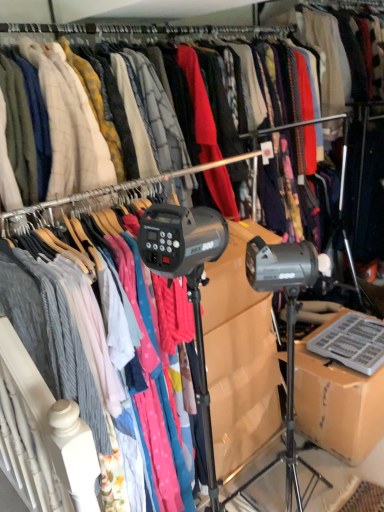
Question: Is brown cardboard box at lower right to the right of matte gray sweater at center from the viewer's perspective?

Choices:
 (A) no
 (B) yes

Answer: (B)

Question: Does brown cardboard box at lower right contain matte gray sweater at center?

Choices:
 (A) no
 (B) yes

Answer: (A)

Question: Considering the relative sizes of brown cardboard box at lower right and matte gray sweater at center in the image provided, is brown cardboard box at lower right shorter than matte gray sweater at center?

Choices:
 (A) no
 (B) yes

Answer: (B)

Question: Considering the relative positions of brown cardboard box at lower right and matte gray sweater at center in the image provided, is brown cardboard box at lower right behind matte gray sweater at center?

Choices:
 (A) no
 (B) yes

Answer: (B)

Question: From the image's perspective, does brown cardboard box at lower right appear higher than matte gray sweater at center?

Choices:
 (A) no
 (B) yes

Answer: (A)

Question: Is brown cardboard box at lower right not within matte gray sweater at center?

Choices:
 (A) no
 (B) yes

Answer: (B)

Question: Can you see matte gray sweater at center touching brown cardboard box at lower right?

Choices:
 (A) yes
 (B) no

Answer: (B)

Question: Considering the relative sizes of matte gray sweater at center and brown cardboard box at lower right in the image provided, is matte gray sweater at center smaller than brown cardboard box at lower right?

Choices:
 (A) yes
 (B) no

Answer: (B)

Question: From the image's perspective, is matte gray sweater at center under brown cardboard box at lower right?

Choices:
 (A) no
 (B) yes

Answer: (A)

Question: Considering the relative sizes of matte gray sweater at center and brown cardboard box at lower right in the image provided, is matte gray sweater at center shorter than brown cardboard box at lower right?

Choices:
 (A) yes
 (B) no

Answer: (B)

Question: Does matte gray sweater at center have a larger size compared to brown cardboard box at lower right?

Choices:
 (A) no
 (B) yes

Answer: (B)

Question: From a real-world perspective, is matte gray sweater at center physically below brown cardboard box at lower right?

Choices:
 (A) no
 (B) yes

Answer: (A)

Question: From the image's perspective, relative to matte gray sweater at center, is brown cardboard box at lower right above or below?

Choices:
 (A) above
 (B) below

Answer: (B)